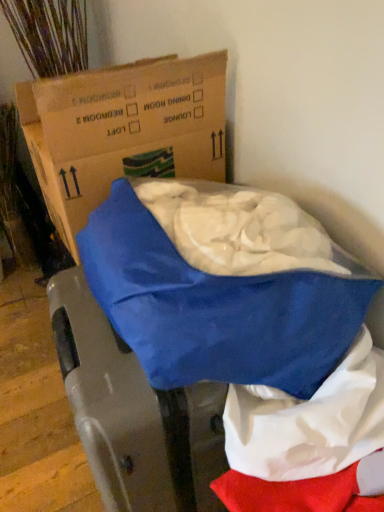
Image resolution: width=384 pixels, height=512 pixels. In order to click on blue fabric bag at center in this screenshot , I will do `click(309, 421)`.

This screenshot has height=512, width=384. Describe the element at coordinates (309, 421) in the screenshot. I see `blue fabric bag at center` at that location.

This screenshot has width=384, height=512. Find the location of `blue fabric bag at center`. blue fabric bag at center is located at coordinates (309, 421).